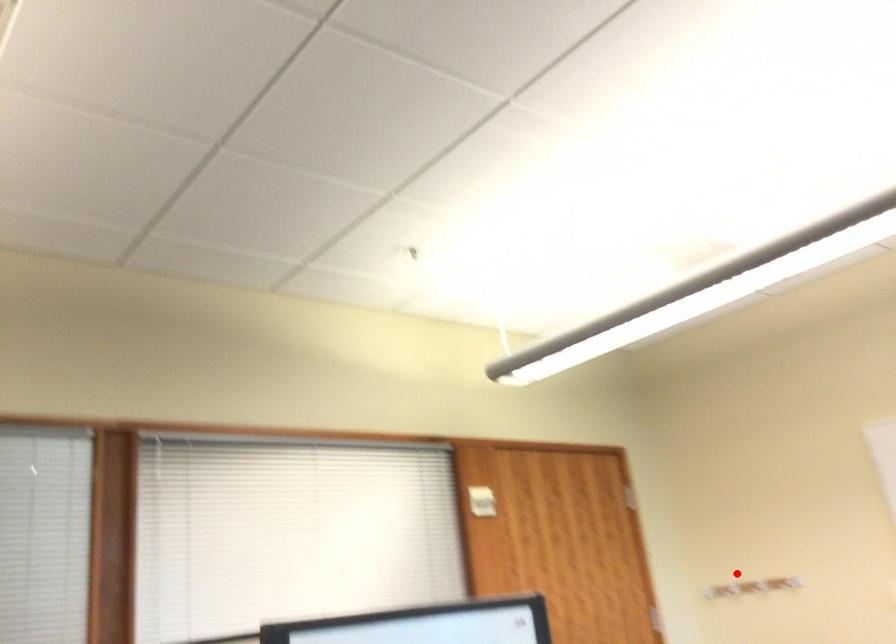
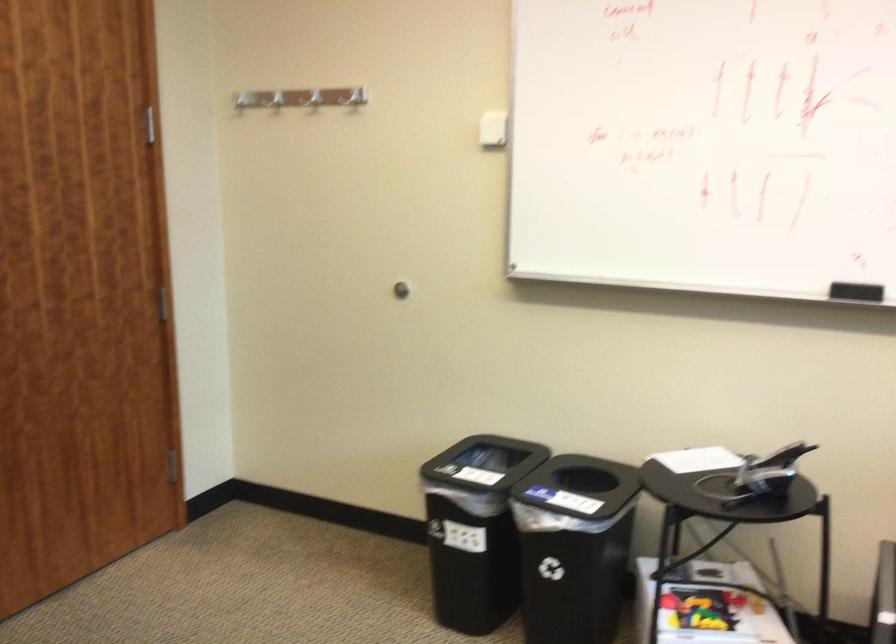
Locate, in the second image, the point that corresponds to the highlighted location in the first image.

(352, 97)